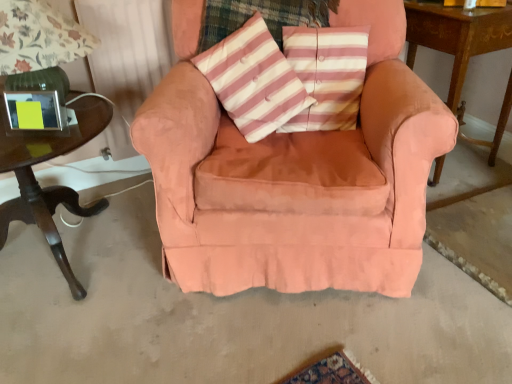
Question: Is point (238, 79) closer or farther from the camera than point (498, 11)?

Choices:
 (A) closer
 (B) farther

Answer: (A)

Question: Visually, is pink striped fabric pillow at center positioned to the left or to the right of wooden table at right, arranged as the 1th table when viewed from the right?

Choices:
 (A) left
 (B) right

Answer: (A)

Question: Which object is the farthest from the suede-like peach armchair at center?

Choices:
 (A) pink striped cushion at center
 (B) dark wood table at left, positioned as the second table in right-to-left order
 (C) pink striped fabric pillow at center
 (D) green glass table lamp at left
 (E) wooden table at right, the second table when ordered from left to right

Answer: (E)

Question: Which is farther from the wooden table at right, the second table when ordered from left to right?

Choices:
 (A) pink striped cushion at center
 (B) suede-like peach armchair at center
 (C) dark wood table at left, positioned as the first table in left-to-right order
 (D) green glass table lamp at left
 (E) pink striped fabric pillow at center

Answer: (C)